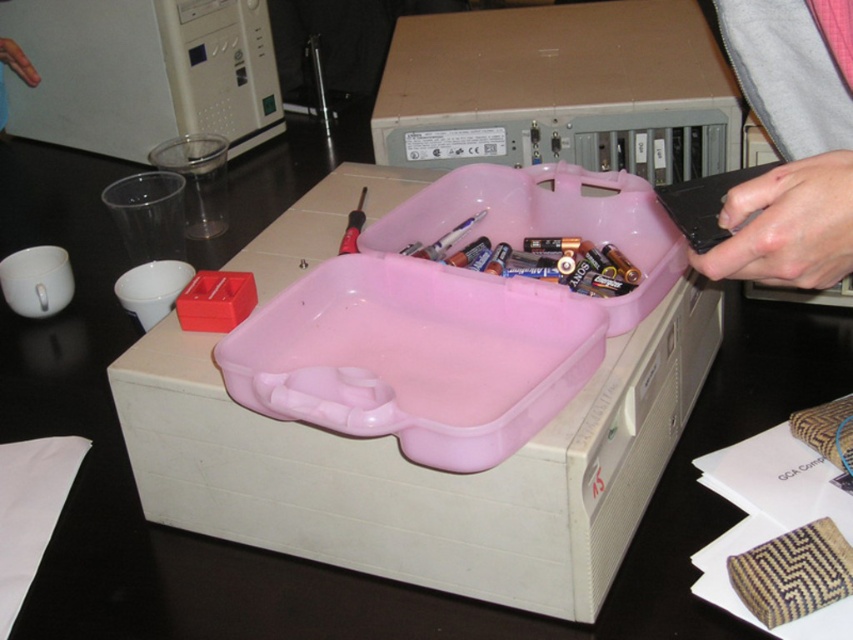
Between point (512, 58) and point (834, 202), which one is positioned in front?

Point (834, 202)

Who is positioned more to the right, matte cardboard box at center or gray fabric sleeve at upper right?

gray fabric sleeve at upper right

Is point (612, 131) positioned before point (753, 225)?

No, it is not.

At what (x,y) coordinates should I click in order to perform the action: click on matte cardboard box at center. Please return your answer as a coordinate pair (x, y). The height and width of the screenshot is (640, 853). Looking at the image, I should click on (560, 90).